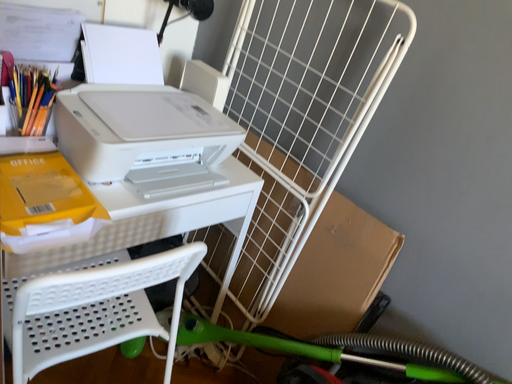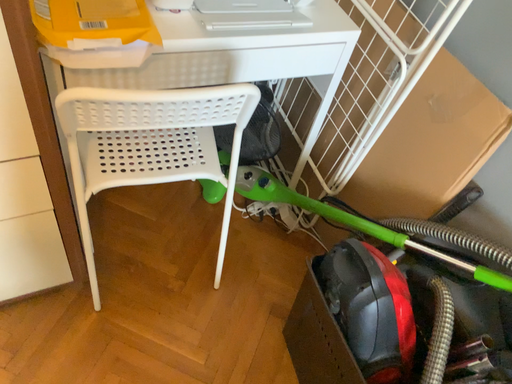
Question: Which way did the camera rotate in the video?

Choices:
 (A) rotated right
 (B) rotated left

Answer: (B)